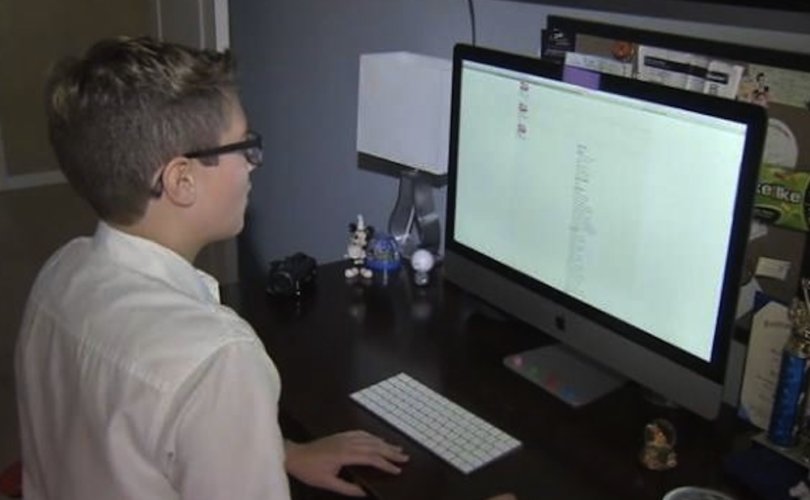
Where is `knick knack`? This screenshot has height=500, width=810. knick knack is located at coordinates (658, 451), (420, 266), (381, 258), (360, 253), (301, 284).